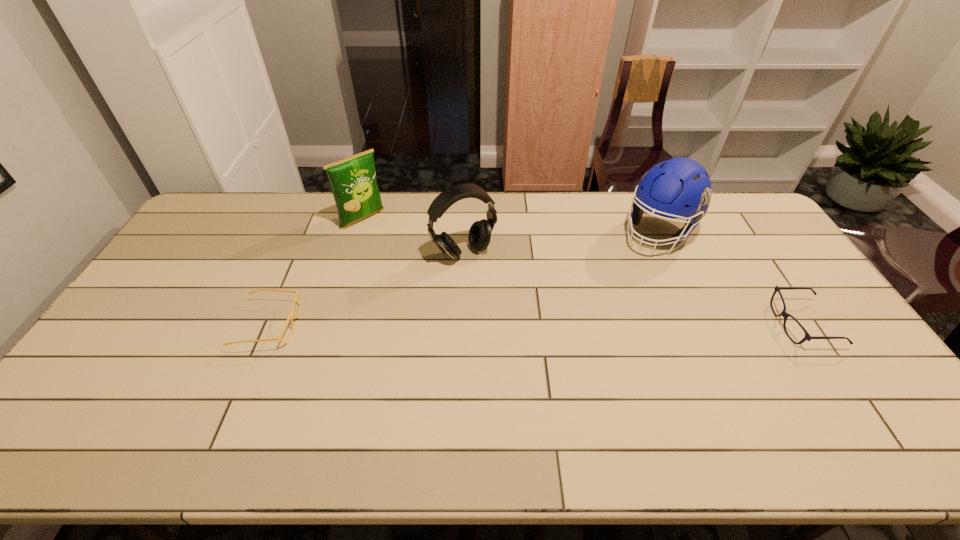
At what (x,y) coordinates should I click in order to perform the action: click on the leftmost object. Please return your answer as a coordinate pair (x, y). Looking at the image, I should click on (292, 314).

In order to click on the right spectacles in this screenshot , I will do `click(807, 337)`.

The height and width of the screenshot is (540, 960). What are the coordinates of `earphone` in the screenshot? It's located at (479, 236).

Find the location of a particular element. the fourth object from left to right is located at coordinates (680, 187).

In order to click on the fourth object from right to left in this screenshot , I will do `click(353, 181)`.

Where is `free space located 0.240m in front of the lenses of the leftmost object`? free space located 0.240m in front of the lenses of the leftmost object is located at coordinates (382, 326).

The image size is (960, 540). What are the coordinates of `free spot located on the front-facing side of the rightmost object` in the screenshot? It's located at (732, 324).

At what (x,y) coordinates should I click in order to perform the action: click on free space located 0.250m on the front-facing side of the rightmost object. Please return your answer as a coordinate pair (x, y). Image resolution: width=960 pixels, height=540 pixels. Looking at the image, I should click on (687, 324).

Identify the location of free space located on the front-facing side of the rightmost object. This screenshot has width=960, height=540. (690, 324).

The image size is (960, 540). I want to click on blank space located on the ear cups of the third object from right to left, so click(504, 302).